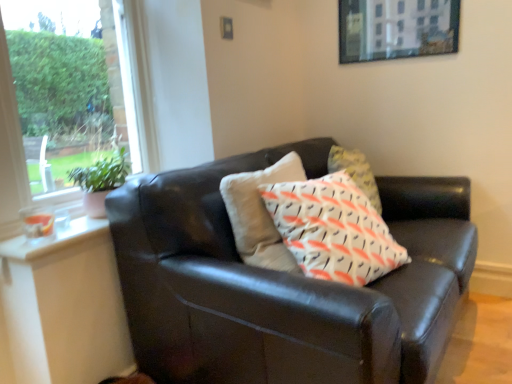
What are the coordinates of `free space in front of green leafy plant at left` in the screenshot? It's located at (72, 230).